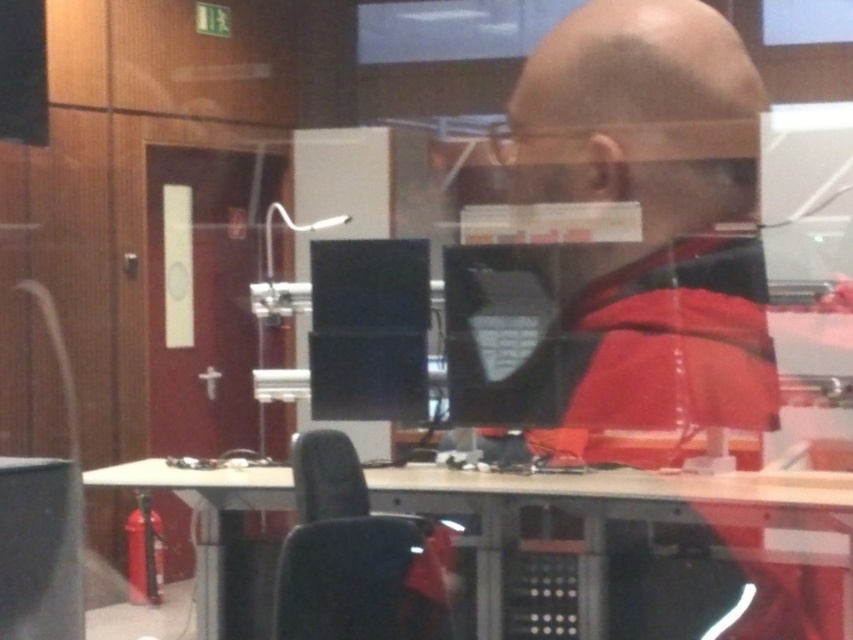
What object is located at the coordinates point (614,513)?

The wooden table at center is located at point (614,513).